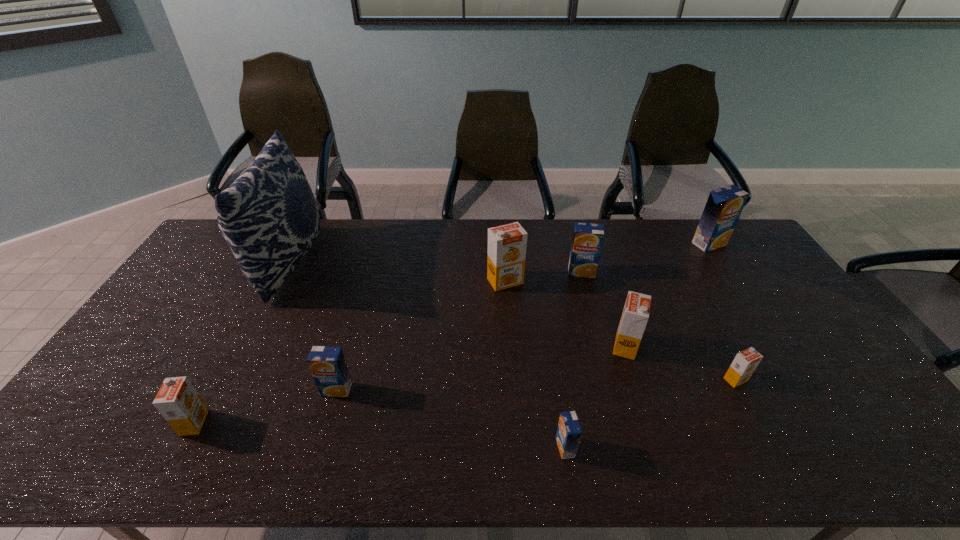
Locate an element on the screen. The width and height of the screenshot is (960, 540). orange orange juice that is the fourth closest to the second blue orange_juice from right to left is located at coordinates (178, 402).

The image size is (960, 540). I want to click on orange orange juice that is the second nearest to the third blue orange_juice from right to left, so click(x=744, y=364).

Identify the location of free space in the image that satisfies the following two spatial constraints: 1. on the front surface of the blue cushion; 2. on the front side of the nearest orange orange juice. (207, 422).

The width and height of the screenshot is (960, 540). Find the location of `vacant region that satisfies the following two spatial constraints: 1. on the back side of the leftmost orange_juice; 2. on the left side of the third smallest orange orange juice`. vacant region that satisfies the following two spatial constraints: 1. on the back side of the leftmost orange_juice; 2. on the left side of the third smallest orange orange juice is located at coordinates (235, 346).

This screenshot has width=960, height=540. In order to click on vacant region that satisfies the following two spatial constraints: 1. on the front surface of the cushion; 2. on the back side of the leftmost blue orange_juice in this screenshot , I will do `click(225, 389)`.